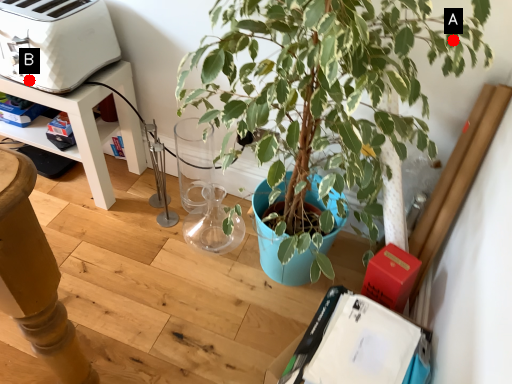
Question: Two points are circled on the image, labeled by A and B beside each circle. Which point is further to the camera?

Choices:
 (A) A is further
 (B) B is further

Answer: (B)